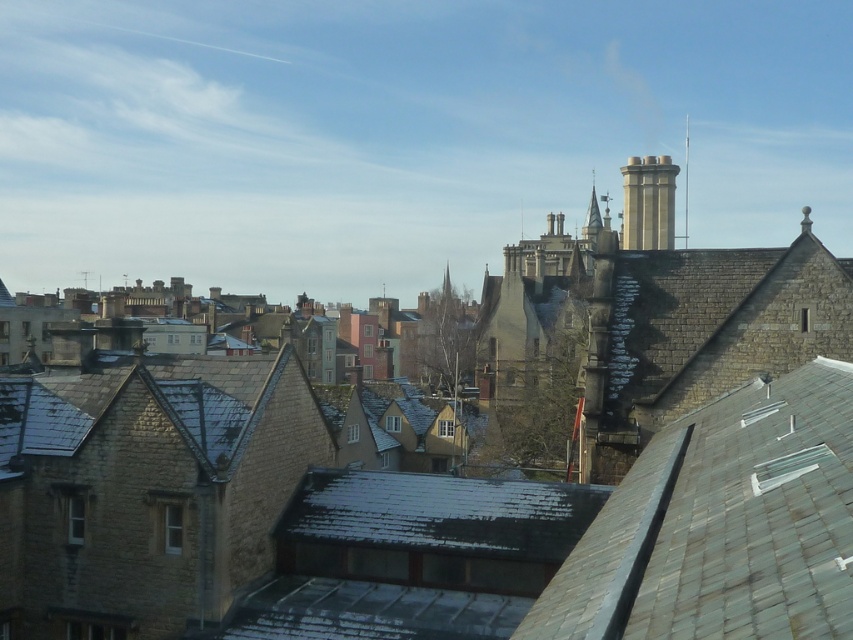
Question: Which of the following is the farthest from the observer?

Choices:
 (A) (650, 243)
 (B) (688, 115)

Answer: (B)

Question: Where is stone chimney at upper right located in relation to smooth stone spire at upper center in the image?

Choices:
 (A) below
 (B) above

Answer: (A)

Question: Does stone chimney at upper right have a smaller size compared to smooth stone spire at upper center?

Choices:
 (A) yes
 (B) no

Answer: (A)

Question: Does stone chimney at upper right have a larger size compared to smooth stone spire at upper center?

Choices:
 (A) yes
 (B) no

Answer: (B)

Question: Which point is closer to the camera?

Choices:
 (A) stone chimney at upper right
 (B) smooth stone spire at upper center

Answer: (A)

Question: Which object appears farthest from the camera in this image?

Choices:
 (A) stone chimney at upper right
 (B) smooth stone spire at upper center

Answer: (B)